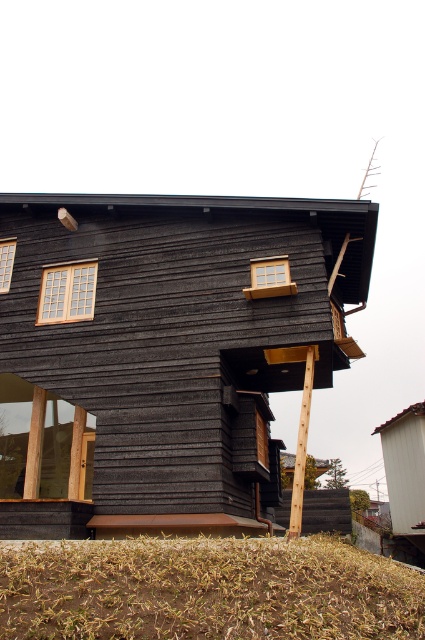
You are a delivery person approaching the house and need to locate the front door. You see the transparent glass window at lower left and the matte wood window at upper left. Which window is closer to the front door?

The transparent glass window at lower left is closer to the front door because it is located below the matte wood window at upper left, suggesting it is positioned lower on the house structure.

Based on the photo, you are a delivery person trying to reach the front door of the house. You see the transparent glass window at lower left and the matte wooden window at upper left. Which window is closer to your current position?

The transparent glass window at lower left is closer to your current position because it is located at the lower part of the house compared to the matte wooden window at upper left, which is positioned higher up.

You are standing in front of the modern house and want to determine the spatial relationship between two specific points marked on the structure. Which of the two points, point (104, 636) or point (266, 257), is positioned closer to you?

Point (104, 636) is closer to the viewer than point (266, 257).